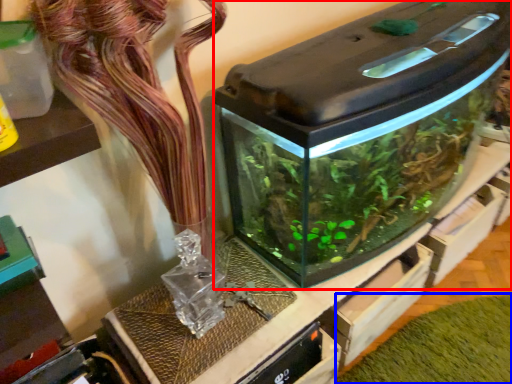
Question: Which of the following is the closest to the observer, water tank (highlighted by a red box) or plant (highlighted by a blue box)?

Choices:
 (A) water tank
 (B) plant

Answer: (A)